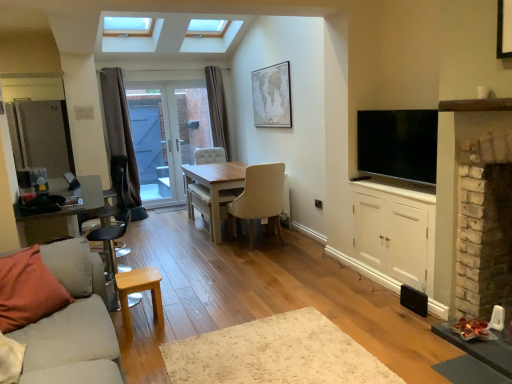
Question: Considering the relative sizes of flat screen tv at right and light wood stool at lower left in the image provided, is flat screen tv at right shorter than light wood stool at lower left?

Choices:
 (A) yes
 (B) no

Answer: (B)

Question: Can you confirm if flat screen tv at right is smaller than light wood stool at lower left?

Choices:
 (A) yes
 (B) no

Answer: (B)

Question: From a real-world perspective, is flat screen tv at right over light wood stool at lower left?

Choices:
 (A) no
 (B) yes

Answer: (B)

Question: Can you confirm if flat screen tv at right is taller than light wood stool at lower left?

Choices:
 (A) no
 (B) yes

Answer: (B)

Question: Is flat screen tv at right outside light wood stool at lower left?

Choices:
 (A) yes
 (B) no

Answer: (A)

Question: Considering the positions of light wood stool at lower left and white glossy door at center in the image, is light wood stool at lower left wider or thinner than white glossy door at center?

Choices:
 (A) wide
 (B) thin

Answer: (A)

Question: Is light wood stool at lower left situated inside white glossy door at center or outside?

Choices:
 (A) inside
 (B) outside

Answer: (B)

Question: From a real-world perspective, is light wood stool at lower left positioned above or below white glossy door at center?

Choices:
 (A) above
 (B) below

Answer: (B)

Question: From the image's perspective, is light wood stool at lower left above or below white glossy door at center?

Choices:
 (A) above
 (B) below

Answer: (B)

Question: Is orange cotton pillow at lower left spatially inside beige textured map at upper center, or outside of it?

Choices:
 (A) outside
 (B) inside

Answer: (A)

Question: From a real-world perspective, is orange cotton pillow at lower left above or below beige textured map at upper center?

Choices:
 (A) below
 (B) above

Answer: (A)

Question: From the image's perspective, relative to beige textured map at upper center, is orange cotton pillow at lower left above or below?

Choices:
 (A) above
 (B) below

Answer: (B)

Question: In terms of height, does orange cotton pillow at lower left look taller or shorter compared to beige textured map at upper center?

Choices:
 (A) tall
 (B) short

Answer: (B)

Question: Based on their sizes in the image, would you say white wood cabinet at right is bigger or smaller than brown fabric curtain at left, which appears as the second curtain when viewed from the back?

Choices:
 (A) big
 (B) small

Answer: (A)

Question: Relative to brown fabric curtain at left, which is the second curtain from right to left, is white wood cabinet at right in front or behind?

Choices:
 (A) behind
 (B) front

Answer: (B)